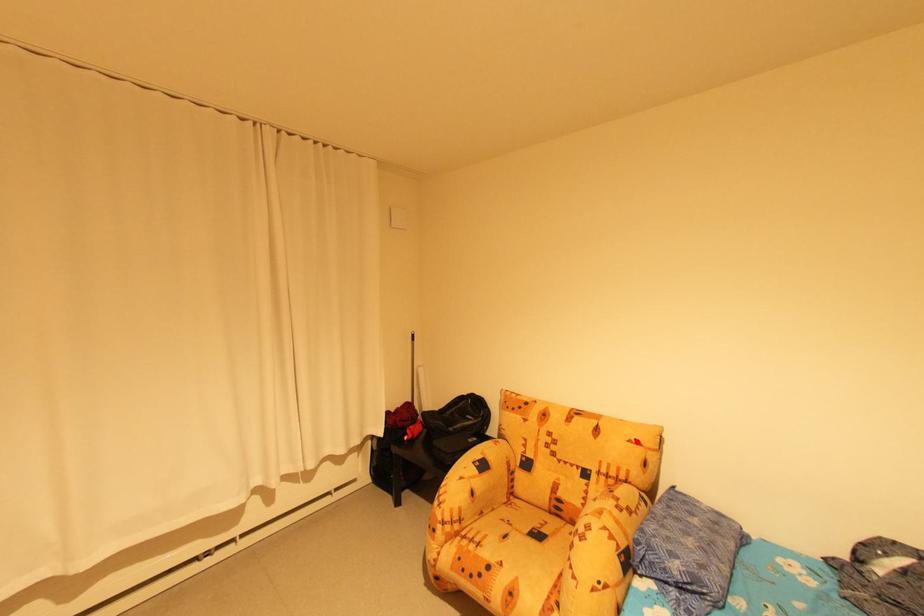
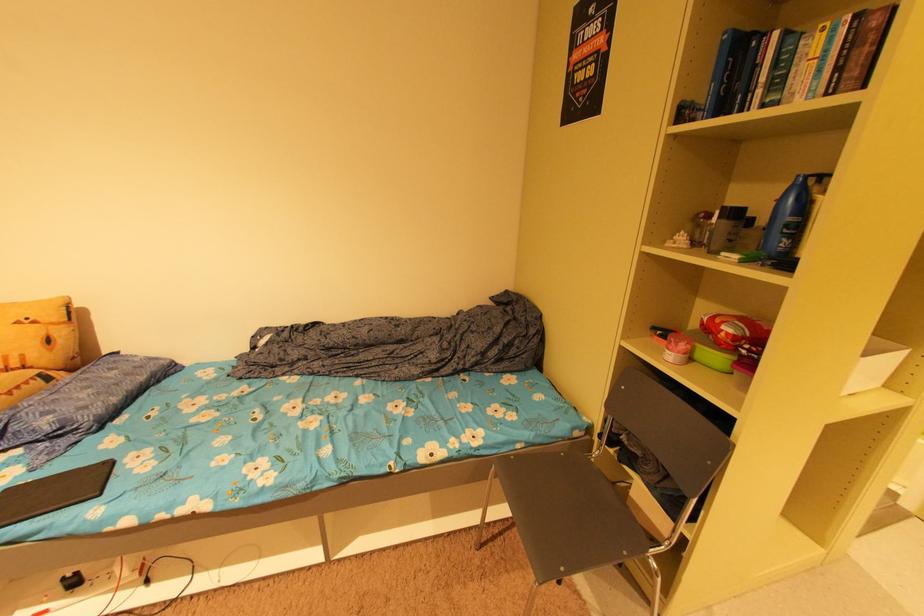
Find the pixel in the second image that matches the highlighted location in the first image.

(23, 323)